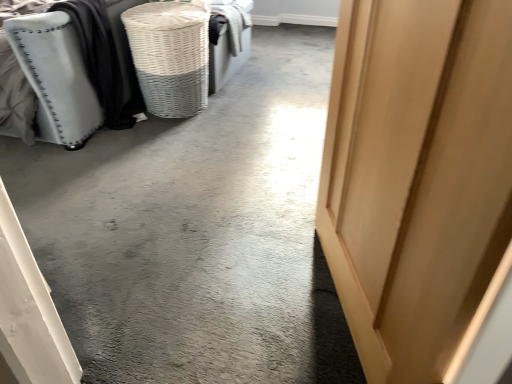
I want to click on light wood door at center right, so click(416, 175).

You are a GUI agent. You are given a task and a screenshot of the screen. Output one action in this format:
    pyautogui.click(x=<x>, y=<y>)
    Task: Click on the matte gray fabric ottoman at left
    This screenshot has height=384, width=512.
    Given the screenshot: What is the action you would take?
    pyautogui.click(x=73, y=72)

Considering the relative positions of matte gray fabric ottoman at left and light wood door at center right in the image provided, is matte gray fabric ottoman at left to the left of light wood door at center right from the viewer's perspective?

Indeed, matte gray fabric ottoman at left is positioned on the left side of light wood door at center right.

The image size is (512, 384). Find the location of `furniture beneath the light wood door at center right (from a real-world perspective)`. furniture beneath the light wood door at center right (from a real-world perspective) is located at coordinates (73, 72).

From the image's perspective, which one is positioned lower, matte gray fabric ottoman at left or light wood door at center right?

light wood door at center right is shown below in the image.

Where is `door in front of the matte gray fabric ottoman at left`? The image size is (512, 384). door in front of the matte gray fabric ottoman at left is located at coordinates (416, 175).

Is point (339, 81) closer to camera compared to point (58, 46)?

Yes, point (339, 81) is in front of point (58, 46).

Based on the photo, between white wicker basket at upper left and matte gray fabric ottoman at left, which one has larger width?

matte gray fabric ottoman at left.

Considering the positions of objects white wicker basket at upper left and matte gray fabric ottoman at left in the image provided, who is more to the right, white wicker basket at upper left or matte gray fabric ottoman at left?

From the viewer's perspective, white wicker basket at upper left appears more on the right side.

Based on the photo, from a real-world perspective, does white wicker basket at upper left stand above matte gray fabric ottoman at left?

Actually, white wicker basket at upper left is physically below matte gray fabric ottoman at left in the real world.

Is white wicker basket at upper left taller or shorter than light wood door at center right?

Clearly, white wicker basket at upper left is shorter compared to light wood door at center right.

From the image's perspective, who appears lower, white wicker basket at upper left or light wood door at center right?

light wood door at center right is shown below in the image.

Is the depth of white wicker basket at upper left greater than that of light wood door at center right?

That is True.

Does point (196, 30) appear closer or farther from the camera than point (450, 254)?

Point (196, 30) is farther from the camera than point (450, 254).

Considering the positions of objects light wood door at center right and white wicker basket at upper left in the image provided, who is behind, light wood door at center right or white wicker basket at upper left?

white wicker basket at upper left.

From the image's perspective, is light wood door at center right below white wicker basket at upper left?

Correct, light wood door at center right appears lower than white wicker basket at upper left in the image.

Which of these two, light wood door at center right or white wicker basket at upper left, is smaller?

white wicker basket at upper left is smaller.

Looking at this image, between matte gray fabric ottoman at left and white wicker basket at upper left, which one is positioned in front?

Positioned in front is matte gray fabric ottoman at left.

Is matte gray fabric ottoman at left looking in the opposite direction of white wicker basket at upper left?

That's not correct — matte gray fabric ottoman at left is not looking away from white wicker basket at upper left.

At what (x,y) coordinates should I click in order to perform the action: click on basket on the right of matte gray fabric ottoman at left. Please return your answer as a coordinate pair (x, y). The image size is (512, 384). Looking at the image, I should click on (170, 55).

From the image's perspective, is matte gray fabric ottoman at left over white wicker basket at upper left?

No.

This screenshot has height=384, width=512. Identify the location of furniture behind the light wood door at center right. (73, 72).

Identify the location of door above the matte gray fabric ottoman at left (from a real-world perspective). The height and width of the screenshot is (384, 512). (416, 175).

Which object lies further to the anchor point light wood door at center right, matte gray fabric ottoman at left or white wicker basket at upper left?

matte gray fabric ottoman at left is positioned further to the anchor light wood door at center right.

Estimate the real-world distances between objects in this image. Which object is further from white wicker basket at upper left, matte gray fabric ottoman at left or light wood door at center right?

The object further to white wicker basket at upper left is light wood door at center right.

From the image, which object appears to be farther from light wood door at center right, white wicker basket at upper left or matte gray fabric ottoman at left?

matte gray fabric ottoman at left is further to light wood door at center right.

Based on their spatial positions, is white wicker basket at upper left or light wood door at center right closer to matte gray fabric ottoman at left?

Based on the image, white wicker basket at upper left appears to be nearer to matte gray fabric ottoman at left.

Looking at the image, which one is located closer to matte gray fabric ottoman at left, light wood door at center right or white wicker basket at upper left?

white wicker basket at upper left.

When comparing their distances from white wicker basket at upper left, does light wood door at center right or matte gray fabric ottoman at left seem closer?

matte gray fabric ottoman at left is positioned closer to the anchor white wicker basket at upper left.

The image size is (512, 384). What are the coordinates of `furniture positioned between light wood door at center right and white wicker basket at upper left from near to far` in the screenshot? It's located at (73, 72).